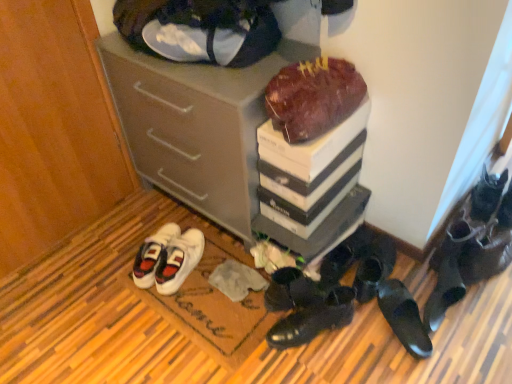
Identify the location of free space underneath black leather shoes at lower right, positioned as the sixth footwear in left-to-right order (from a real-world perspective). This screenshot has width=512, height=384. (399, 319).